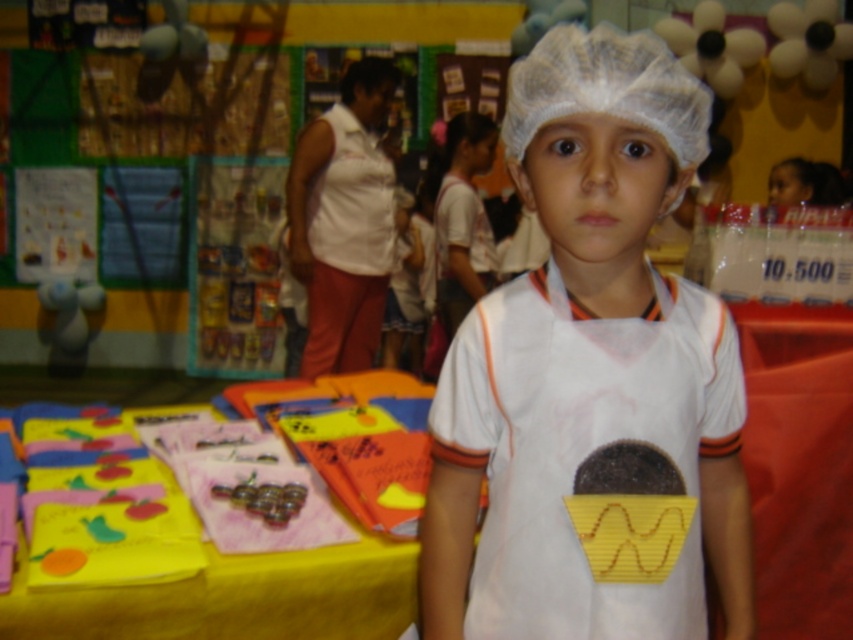
You are a student in the classroom and you want to place a small sticker on the white matte hairnet at center. Since the yellow fabric at lower left is underneath it, will the sticker be visible from above?

The white matte hairnet at center is positioned over the yellow fabric at lower left, so placing the sticker on the white matte hairnet at center will make it visible from above since it is covering the yellow fabric at lower left.

The child is standing in a classroom setting with a white matte hairnet at center. Where exactly is the white matte hairnet located on the child?

The white matte hairnet at center is located at point (590, 374) on the child.

You are a student in the classroom and need to place a 12 inch ruler between the yellow fabric at lower left and the white mesh hat at center. Is there enough space to fit the ruler horizontally between them?

The yellow fabric at lower left and white mesh hat at center are 24.38 inches apart from each other. Since the ruler is 12 inches long, there is sufficient space to place it horizontally between them.